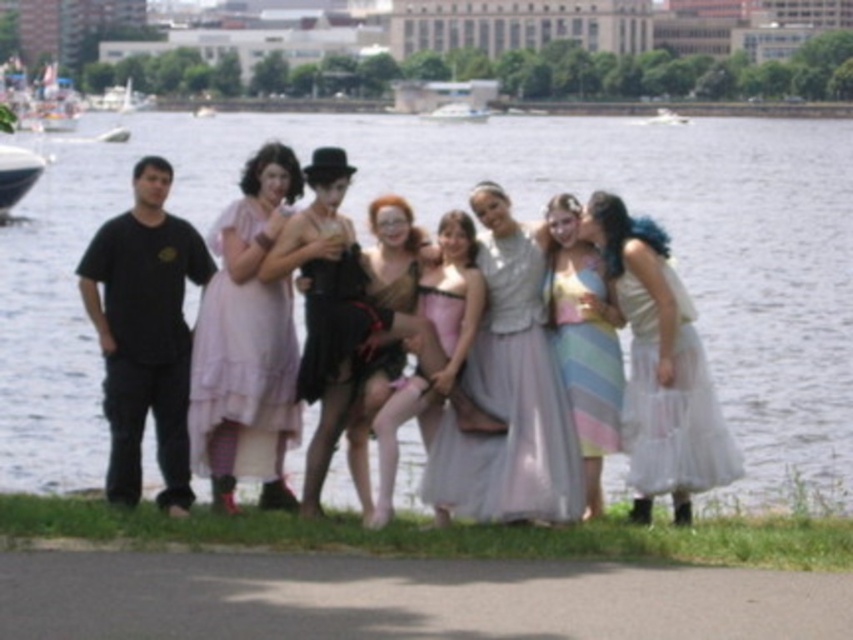
You are a photographer trying to capture the group photo. The pink chiffon dress at center is at point 0.534, 0.291. If you want to frame the dress exactly at the center of the image, which is point 0.5, 0.5, should you move the camera left, right, up, or down?

Answer: The pink chiffon dress at center is located at point (247,340). To center it at (426,320), you need to move the camera slightly to the left to decrease the x coordinate from 0.534 to 0.5 and move it upward to increase the y coordinate from 0.291 to 0.5.

You are planning to take a photo of the white plastic boat at left and the pastel chiffon dress at center. Which object should you focus on first if you want to capture both in the same frame without moving the camera?

The pastel chiffon dress at center is positioned under the white plastic boat at left, so focusing on the white plastic boat at left first would ensure both are in the frame as the dress is beneath it.

You are organizing a group photo and need to ensure there is enough space between the two central dresses for a photographer to walk through. The photographer requires at least 4 meters of clearance. Based on the scene, will there be enough space between the pink chiffon dress at center and the pastel striped dress at center?

The pink chiffon dress at center and pastel striped dress at center are 4.34 meters apart, which exceeds the required 4 meters of clearance. Therefore, there is sufficient space for the photographer to walk through between them.